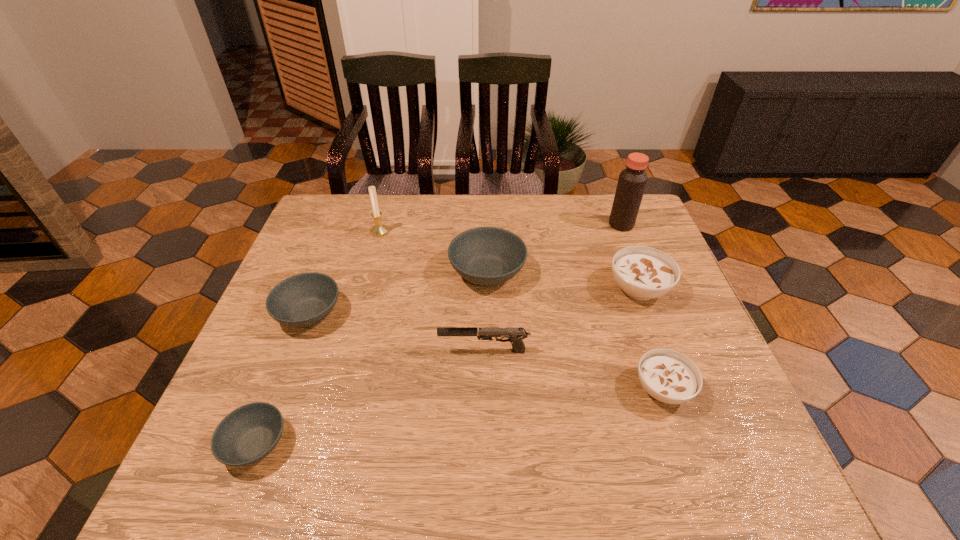
Where is `free space that satisfies the following two spatial constraints: 1. on the front side of the nearer white soup bowl; 2. on the left side of the biggest gray soup bowl`? free space that satisfies the following two spatial constraints: 1. on the front side of the nearer white soup bowl; 2. on the left side of the biggest gray soup bowl is located at coordinates (490, 389).

Locate an element on the screen. vacant region that satisfies the following two spatial constraints: 1. on the front side of the sixth object from right to left; 2. on the right side of the biggest gray soup bowl is located at coordinates (369, 272).